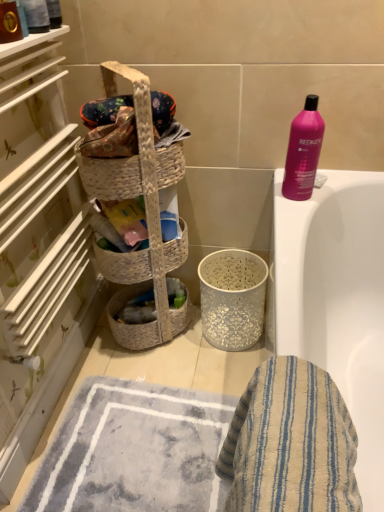
Question: Is woven beige laundry basket at left directly adjacent to woven natural picnic basket at center?

Choices:
 (A) yes
 (B) no

Answer: (B)

Question: Could you tell me if woven beige laundry basket at left is turned towards woven natural picnic basket at center?

Choices:
 (A) no
 (B) yes

Answer: (B)

Question: Does woven beige laundry basket at left have a larger size compared to woven natural picnic basket at center?

Choices:
 (A) no
 (B) yes

Answer: (B)

Question: Is woven beige laundry basket at left at the left side of woven natural picnic basket at center?

Choices:
 (A) no
 (B) yes

Answer: (A)

Question: Is woven beige laundry basket at left positioned far away from woven natural picnic basket at center?

Choices:
 (A) yes
 (B) no

Answer: (B)

Question: Considering the relative sizes of woven beige laundry basket at left and woven natural picnic basket at center in the image provided, is woven beige laundry basket at left taller than woven natural picnic basket at center?

Choices:
 (A) no
 (B) yes

Answer: (B)

Question: From the image's perspective, is pink glossy shampoo at upper right on blue striped cloth at lower right?

Choices:
 (A) no
 (B) yes

Answer: (B)

Question: Does pink glossy shampoo at upper right have a smaller size compared to blue striped cloth at lower right?

Choices:
 (A) yes
 (B) no

Answer: (A)

Question: Can you confirm if pink glossy shampoo at upper right is taller than blue striped cloth at lower right?

Choices:
 (A) yes
 (B) no

Answer: (B)

Question: Is pink glossy shampoo at upper right oriented towards blue striped cloth at lower right?

Choices:
 (A) no
 (B) yes

Answer: (A)

Question: Considering the relative sizes of pink glossy shampoo at upper right and blue striped cloth at lower right in the image provided, is pink glossy shampoo at upper right bigger than blue striped cloth at lower right?

Choices:
 (A) yes
 (B) no

Answer: (B)

Question: Does pink glossy shampoo at upper right appear on the left side of blue striped cloth at lower right?

Choices:
 (A) no
 (B) yes

Answer: (A)

Question: From the image's perspective, does blue striped cloth at lower right appear higher than pink glossy shampoo at upper right?

Choices:
 (A) no
 (B) yes

Answer: (A)